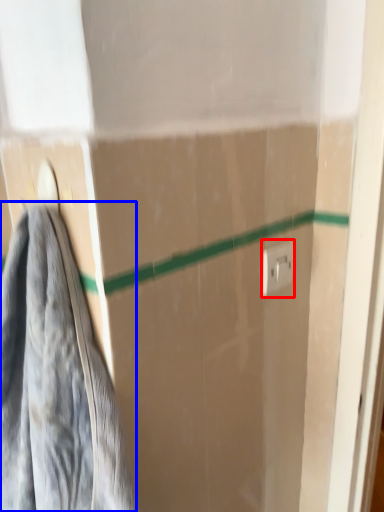
Question: Which of the following is the farthest to the observer, electric outlet (highlighted by a red box) or towel (highlighted by a blue box)?

Choices:
 (A) electric outlet
 (B) towel

Answer: (A)